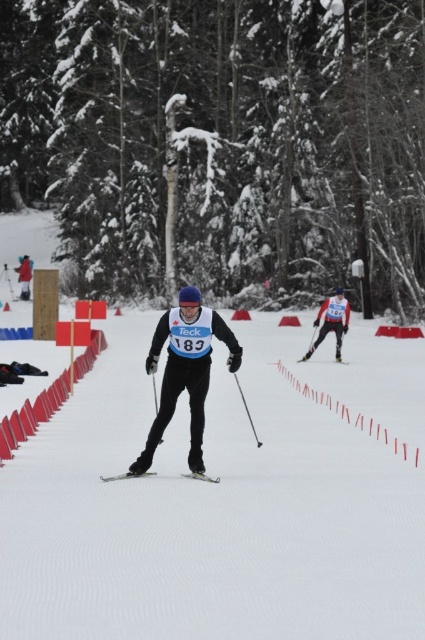
Question: Can you confirm if snow-covered tree at center is bigger than metallic silver ski at center?

Choices:
 (A) no
 (B) yes

Answer: (B)

Question: Which is nearer to the black plastic ski pole at center?

Choices:
 (A) matte black skier at center
 (B) red plastic barrier at left

Answer: (B)

Question: Which is farther from the snow-covered tree at center?

Choices:
 (A) metallic silver ski at center
 (B) red plastic barrier at left
 (C) black plastic ski pole at center
 (D) matte black ski at right

Answer: (A)

Question: Which object appears farthest from the camera in this image?

Choices:
 (A) matte black skier at left
 (B) black plastic ski pole at center

Answer: (A)

Question: Is snow-covered tree at center smaller than metallic silver ski at center?

Choices:
 (A) yes
 (B) no

Answer: (B)

Question: Does white snow ski slope at center have a lesser width compared to matte black skier at left?

Choices:
 (A) no
 (B) yes

Answer: (A)